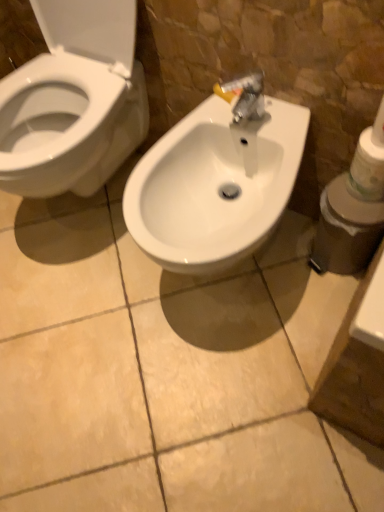
Where is `free location to the left of white plastic container at right`? Image resolution: width=384 pixels, height=512 pixels. free location to the left of white plastic container at right is located at coordinates (288, 269).